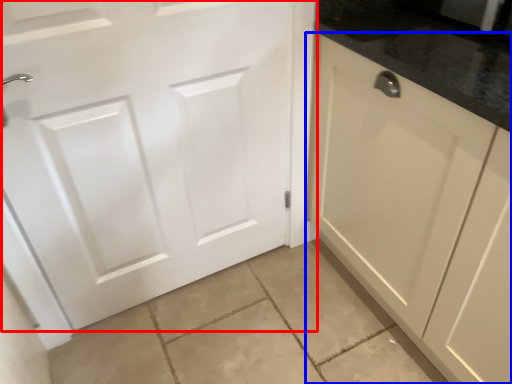
Question: Among these objects, which one is farthest to the camera, door (highlighted by a red box) or cabinetry (highlighted by a blue box)?

Choices:
 (A) door
 (B) cabinetry

Answer: (A)